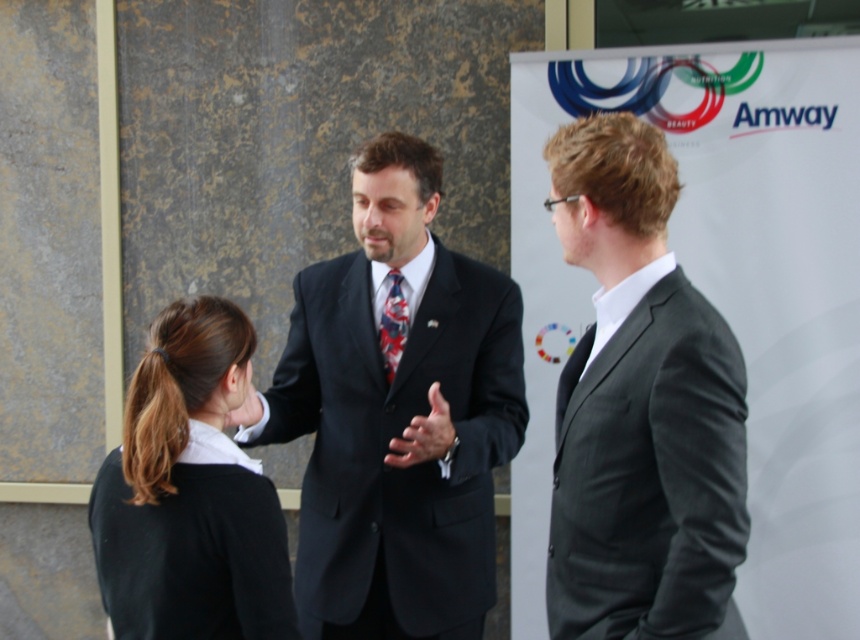
Question: Based on their relative distances, which object is nearer to the black sweater at center?

Choices:
 (A) matte black hand at center
 (B) black suit at center

Answer: (B)

Question: Does black suit at center come in front of black sweater at center?

Choices:
 (A) no
 (B) yes

Answer: (A)

Question: Which of the following is the farthest from the observer?

Choices:
 (A) (x=236, y=307)
 (B) (x=401, y=314)

Answer: (B)

Question: Is dark gray suit at right to the right of blue patterned tie at center from the viewer's perspective?

Choices:
 (A) yes
 (B) no

Answer: (A)

Question: Which object is farther from the camera taking this photo?

Choices:
 (A) blue patterned tie at center
 (B) black suit at center
 (C) dark gray suit at right

Answer: (A)

Question: From the image, what is the correct spatial relationship of dark gray suit at right in relation to blue patterned tie at center?

Choices:
 (A) below
 (B) above

Answer: (A)